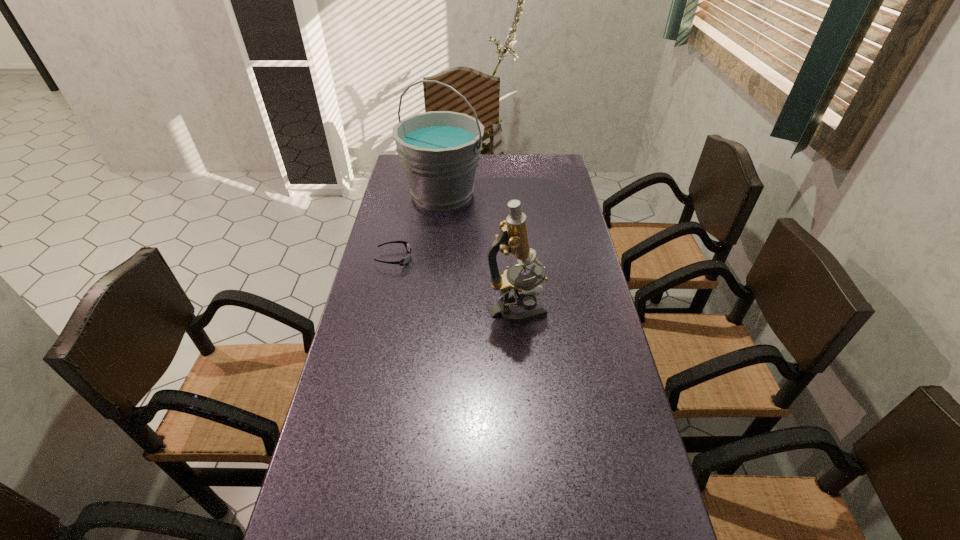
Identify the location of empty space between the second farthest object and the bucket. The height and width of the screenshot is (540, 960). (419, 227).

I want to click on free area in between the bucket and the microscope, so click(x=479, y=252).

Locate an element on the screen. free space between the second tallest object and the farthest object is located at coordinates (479, 252).

I want to click on object that is the closest one to the nearest object, so click(x=404, y=261).

Find the location of a particular element. This screenshot has height=540, width=960. the closest object relative to the tallest object is located at coordinates (404, 261).

Locate an element on the screen. free location that satisfies the following two spatial constraints: 1. on the lenses of the second shortest object; 2. on the left side of the sunglasses is located at coordinates (383, 308).

The width and height of the screenshot is (960, 540). Identify the location of blank area in the image that satisfies the following two spatial constraints: 1. on the lenses of the shortest object; 2. on the right side of the microscope. (383, 308).